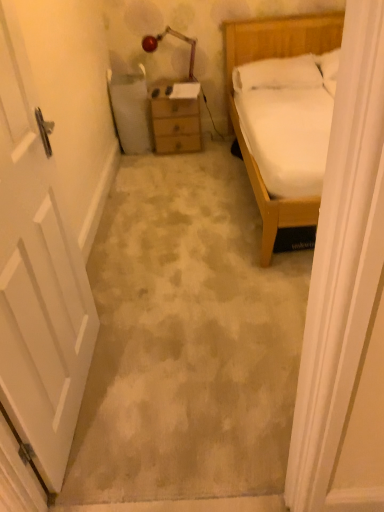
Question: Is metallic red lamp at upper center surrounding wooden chest of drawers at center?

Choices:
 (A) no
 (B) yes

Answer: (A)

Question: Is metallic red lamp at upper center in front of wooden chest of drawers at center?

Choices:
 (A) yes
 (B) no

Answer: (A)

Question: Are metallic red lamp at upper center and wooden chest of drawers at center far apart?

Choices:
 (A) yes
 (B) no

Answer: (B)

Question: Is metallic red lamp at upper center further to camera compared to wooden chest of drawers at center?

Choices:
 (A) yes
 (B) no

Answer: (B)

Question: Is metallic red lamp at upper center to the left of wooden chest of drawers at center from the viewer's perspective?

Choices:
 (A) yes
 (B) no

Answer: (A)

Question: Considering the positions of point pos(150,99) and point pos(99,428), is point pos(150,99) closer or farther from the camera than point pos(99,428)?

Choices:
 (A) closer
 (B) farther

Answer: (B)

Question: Looking at their shapes, would you say wooden chest of drawers at center is wider or thinner than white matte door at left?

Choices:
 (A) thin
 (B) wide

Answer: (A)

Question: Looking at the image, does wooden chest of drawers at center seem bigger or smaller compared to white matte door at left?

Choices:
 (A) big
 (B) small

Answer: (B)

Question: In the image, is wooden chest of drawers at center on the left side or the right side of white matte door at left?

Choices:
 (A) left
 (B) right

Answer: (A)

Question: Is wooden chest of drawers at center in front of or behind metallic red lamp at upper center in the image?

Choices:
 (A) behind
 (B) front

Answer: (A)

Question: Is wooden chest of drawers at center inside or outside of metallic red lamp at upper center?

Choices:
 (A) inside
 (B) outside

Answer: (B)

Question: Is wooden chest of drawers at center taller or shorter than metallic red lamp at upper center?

Choices:
 (A) tall
 (B) short

Answer: (A)

Question: From a real-world perspective, is wooden chest of drawers at center above or below metallic red lamp at upper center?

Choices:
 (A) above
 (B) below

Answer: (B)

Question: In terms of width, does metallic red lamp at upper center look wider or thinner when compared to white matte door at left?

Choices:
 (A) thin
 (B) wide

Answer: (B)

Question: In terms of size, does metallic red lamp at upper center appear bigger or smaller than white matte door at left?

Choices:
 (A) small
 (B) big

Answer: (A)